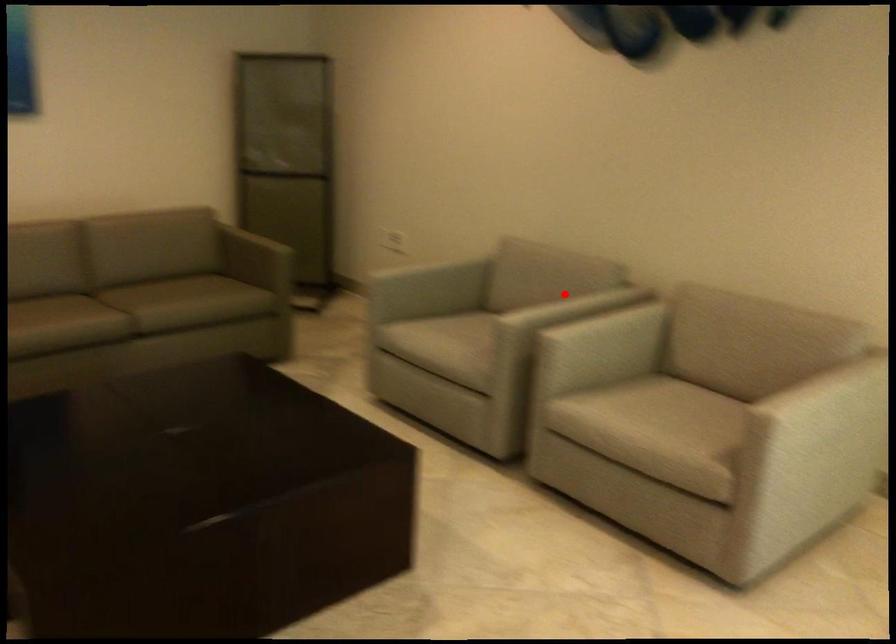
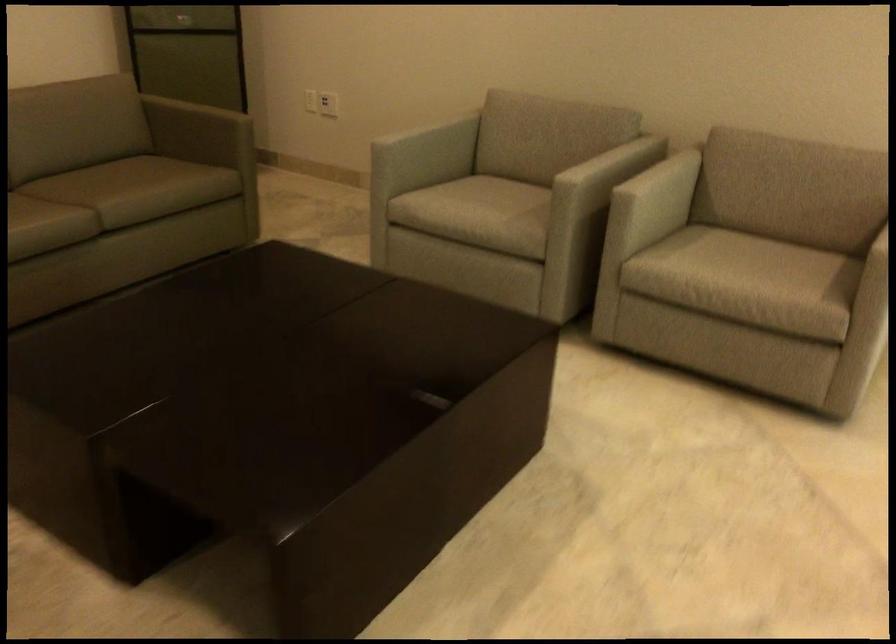
The point at the highlighted location is marked in the first image. Where is the corresponding point in the second image?

(588, 149)